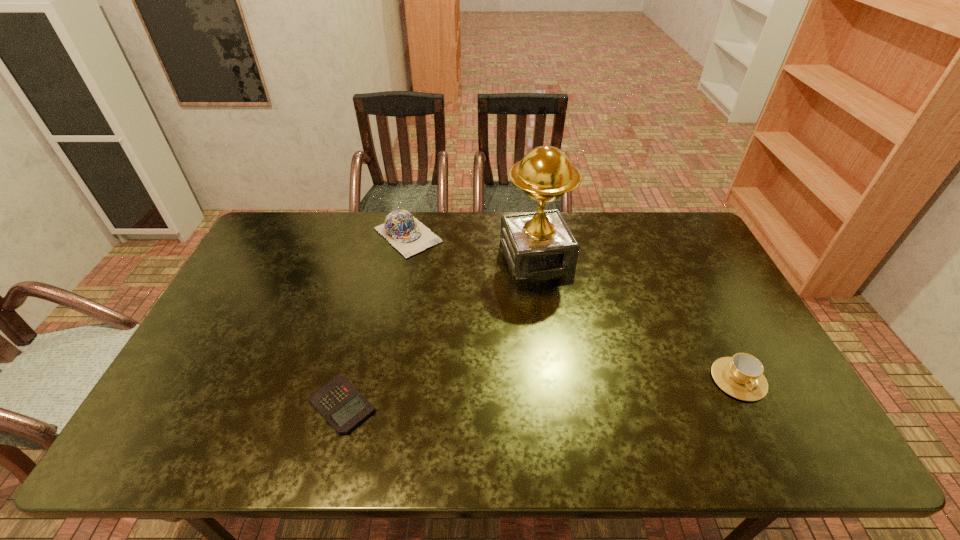
Where is `vacant space located on the front-facing side of the tallest object`? vacant space located on the front-facing side of the tallest object is located at coordinates (581, 354).

Where is `vacant space located 0.300m on the front-facing side of the tallest object`? vacant space located 0.300m on the front-facing side of the tallest object is located at coordinates (581, 354).

Find the location of a particular element. This screenshot has width=960, height=540. vacant space located 0.340m on the front-facing side of the tallest object is located at coordinates (587, 366).

Locate an element on the screen. The width and height of the screenshot is (960, 540). cap positioned at the far edge is located at coordinates (402, 230).

This screenshot has height=540, width=960. What are the coordinates of `award that is at the far edge` in the screenshot? It's located at (540, 243).

The image size is (960, 540). Identify the location of calculator that is at the near edge. (339, 402).

Locate an element on the screen. The image size is (960, 540). cup situated at the near edge is located at coordinates (741, 376).

Where is `object situated at the right edge`? This screenshot has height=540, width=960. object situated at the right edge is located at coordinates (741, 376).

What are the coordinates of `object situated at the near right corner` in the screenshot? It's located at (741, 376).

Where is `vacant space at the far edge of the desktop`? vacant space at the far edge of the desktop is located at coordinates pyautogui.click(x=303, y=246).